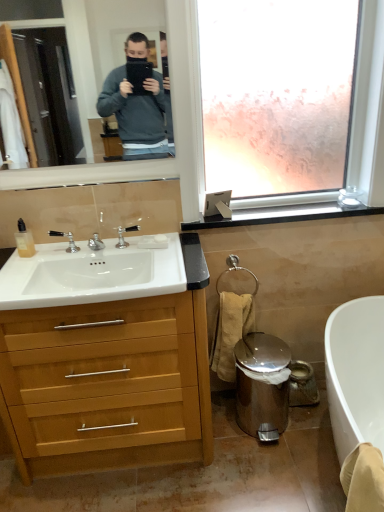
Question: Is black plastic window sill at upper right far away from white matte soap at sink?

Choices:
 (A) yes
 (B) no

Answer: (B)

Question: Considering the relative positions of black plastic window sill at upper right and white matte soap at sink in the image provided, is black plastic window sill at upper right to the right of white matte soap at sink from the viewer's perspective?

Choices:
 (A) no
 (B) yes

Answer: (B)

Question: Does black plastic window sill at upper right appear on the left side of white matte soap at sink?

Choices:
 (A) yes
 (B) no

Answer: (B)

Question: Considering the relative positions of black plastic window sill at upper right and white matte soap at sink in the image provided, is black plastic window sill at upper right in front of white matte soap at sink?

Choices:
 (A) no
 (B) yes

Answer: (A)

Question: Is black plastic window sill at upper right oriented away from white matte soap at sink?

Choices:
 (A) yes
 (B) no

Answer: (B)

Question: Is beige cotton towel at lower right inside the boundaries of polished stainless steel trash can at lower right, or outside?

Choices:
 (A) outside
 (B) inside

Answer: (A)

Question: Considering the positions of point (223, 318) and point (253, 386), is point (223, 318) closer or farther from the camera than point (253, 386)?

Choices:
 (A) closer
 (B) farther

Answer: (A)

Question: Is beige cotton towel at lower right to the left or to the right of polished stainless steel trash can at lower right in the image?

Choices:
 (A) right
 (B) left

Answer: (B)

Question: From a real-world perspective, is beige cotton towel at lower right above or below polished stainless steel trash can at lower right?

Choices:
 (A) below
 (B) above

Answer: (B)

Question: From a real-world perspective, is black plastic window sill at upper right above or below translucent plastic bottle at sink left?

Choices:
 (A) above
 (B) below

Answer: (B)

Question: Considering the relative positions of black plastic window sill at upper right and translucent plastic bottle at sink left in the image provided, is black plastic window sill at upper right to the left or to the right of translucent plastic bottle at sink left?

Choices:
 (A) left
 (B) right

Answer: (B)

Question: Does point (196, 226) appear closer or farther from the camera than point (18, 229)?

Choices:
 (A) farther
 (B) closer

Answer: (A)

Question: Is black plastic window sill at upper right bigger or smaller than translucent plastic bottle at sink left?

Choices:
 (A) small
 (B) big

Answer: (B)

Question: Choose the correct answer: Is black plastic window sill at upper right inside beige cotton towel at lower right or outside it?

Choices:
 (A) outside
 (B) inside

Answer: (A)

Question: Is point (302, 209) closer or farther from the camera than point (230, 374)?

Choices:
 (A) closer
 (B) farther

Answer: (A)